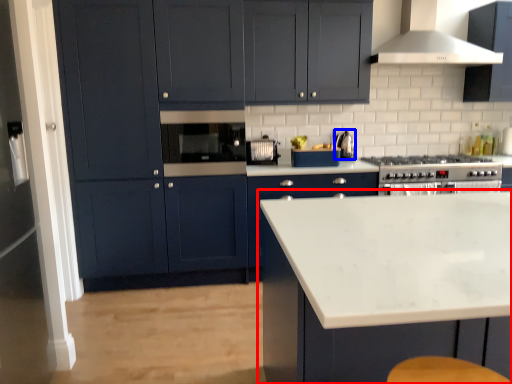
Question: Which object is further to the camera taking this photo, cabinetry (highlighted by a red box) or kitchen appliance (highlighted by a blue box)?

Choices:
 (A) cabinetry
 (B) kitchen appliance

Answer: (B)